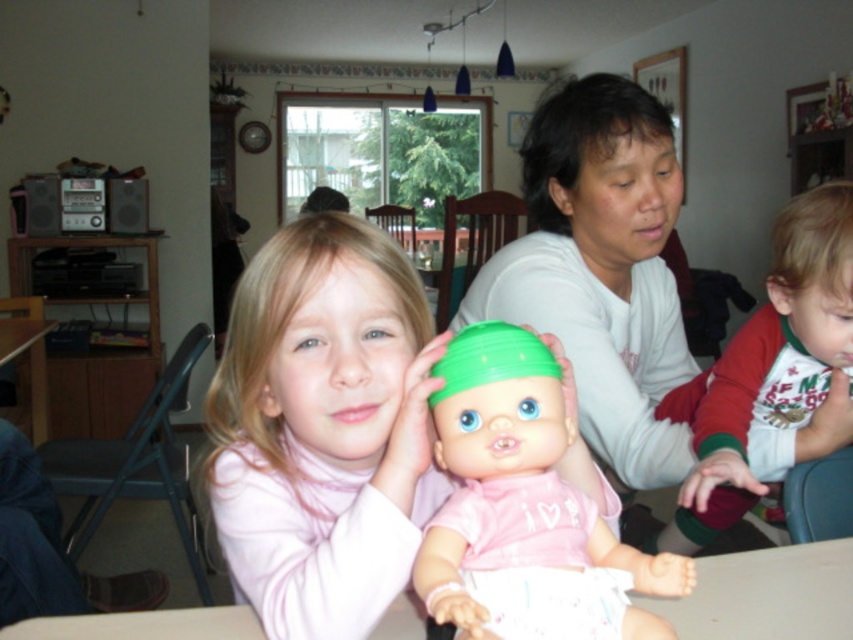
Looking at this image, you are a photographer trying to capture a closeup of the green plastic doll at center. Based on its position in the image, which part of the frame should you focus on to ensure the doll is centered in your shot?

The green plastic doll at center is located at point coordinates approximately at 0.773 on the x axis and 0.611 on the y axis. To center it, focus on the area around those coordinates.

You are a photographer setting up a photo shoot. You have a pink matte doll at center and a white matte doll at center. According to the scene, where should you place the pink matte doll relative to the white matte doll to match the image?

The pink matte doll at center should be placed below the white matte doll at center to match the image.